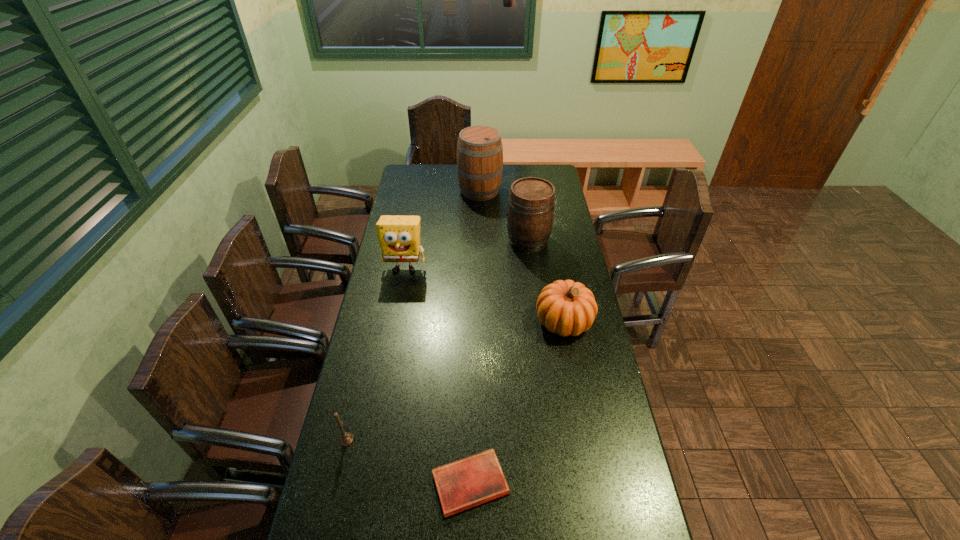
Find the location of a particular element. the farthest object is located at coordinates (479, 148).

Locate an element on the screen. The width and height of the screenshot is (960, 540). the left cider is located at coordinates (479, 148).

Locate an element on the screen. the nearer cider is located at coordinates (530, 214).

Identify the location of the second farthest object. (530, 214).

Image resolution: width=960 pixels, height=540 pixels. What are the coordinates of `sponge` in the screenshot? It's located at (399, 236).

At what (x,y) coordinates should I click in order to perform the action: click on the third nearest object. Please return your answer as a coordinate pair (x, y). Image resolution: width=960 pixels, height=540 pixels. Looking at the image, I should click on (566, 307).

Locate an element on the screen. pumpkin is located at coordinates (566, 307).

Image resolution: width=960 pixels, height=540 pixels. I want to click on the fifth farthest object, so click(x=346, y=438).

Identify the location of the fifth tallest object. (346, 438).

The image size is (960, 540). I want to click on diary, so click(x=471, y=481).